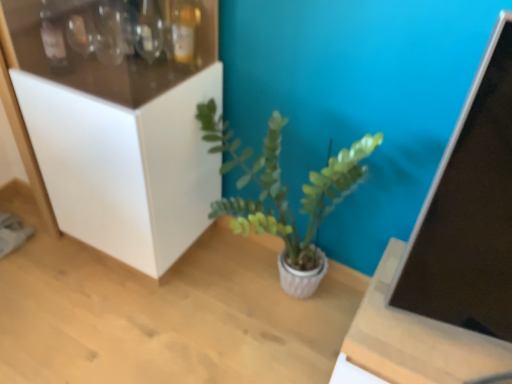
Question: Is wooden table at center not close to green matte plant at center?

Choices:
 (A) no
 (B) yes

Answer: (A)

Question: From a real-world perspective, is wooden table at center positioned over green matte plant at center based on gravity?

Choices:
 (A) no
 (B) yes

Answer: (A)

Question: Is wooden table at center positioned behind green matte plant at center?

Choices:
 (A) yes
 (B) no

Answer: (B)

Question: Is wooden table at center at the right side of green matte plant at center?

Choices:
 (A) no
 (B) yes

Answer: (B)

Question: Is wooden table at center with green matte plant at center?

Choices:
 (A) yes
 (B) no

Answer: (B)

Question: From a real-world perspective, relative to wooden table at center, is green matte plant at center vertically above or below?

Choices:
 (A) above
 (B) below

Answer: (A)

Question: Considering the positions of point (346, 157) and point (374, 288), is point (346, 157) closer or farther from the camera than point (374, 288)?

Choices:
 (A) farther
 (B) closer

Answer: (A)

Question: Is green matte plant at center taller or shorter than wooden table at center?

Choices:
 (A) short
 (B) tall

Answer: (B)

Question: Based on their positions, is green matte plant at center located to the left or right of wooden table at center?

Choices:
 (A) left
 (B) right

Answer: (A)

Question: Considering the positions of wooden table at center and white matte cabinet at left in the image, is wooden table at center bigger or smaller than white matte cabinet at left?

Choices:
 (A) big
 (B) small

Answer: (B)

Question: In the image, is wooden table at center on the left side or the right side of white matte cabinet at left?

Choices:
 (A) left
 (B) right

Answer: (B)

Question: Relative to white matte cabinet at left, is wooden table at center in front or behind?

Choices:
 (A) front
 (B) behind

Answer: (A)

Question: Considering the positions of wooden table at center and white matte cabinet at left in the image, is wooden table at center taller or shorter than white matte cabinet at left?

Choices:
 (A) short
 (B) tall

Answer: (A)

Question: Considering the relative positions of white matte cabinet at left and wooden table at center in the image provided, is white matte cabinet at left to the left or to the right of wooden table at center?

Choices:
 (A) right
 (B) left

Answer: (B)

Question: From the image's perspective, relative to wooden table at center, is white matte cabinet at left above or below?

Choices:
 (A) above
 (B) below

Answer: (A)